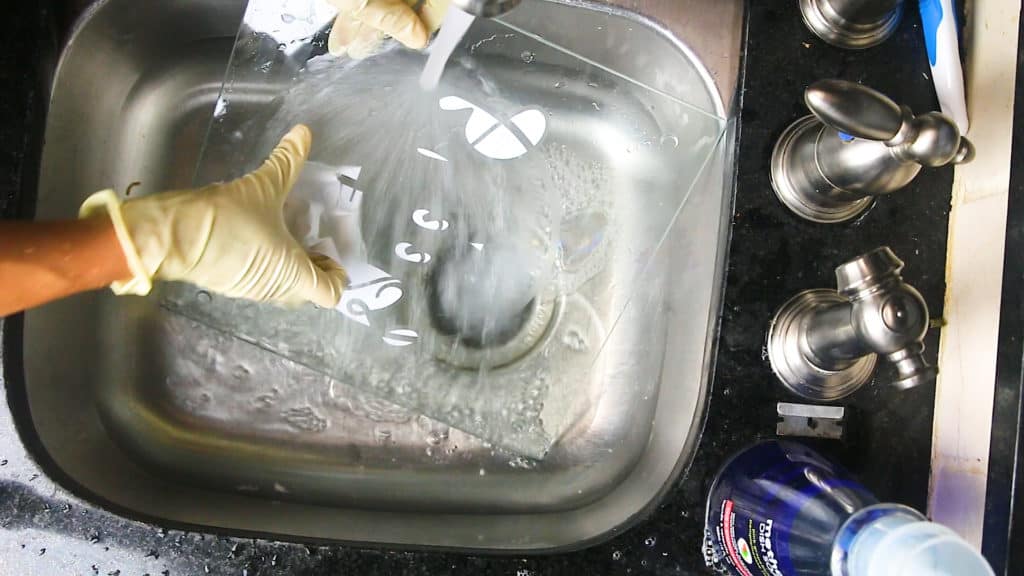
Identify the location of glass cutting board. The width and height of the screenshot is (1024, 576). (571, 169).